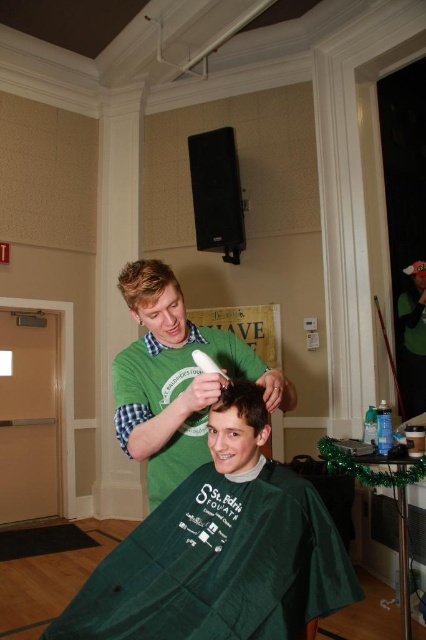
Can you confirm if green matte shirt at center is positioned to the left of blonde hair at upper center?

No, green matte shirt at center is not to the left of blonde hair at upper center.

In order to click on green matte shirt at center in this screenshot , I will do `click(175, 380)`.

Which is in front, point (155, 364) or point (135, 314)?

Point (135, 314) is in front.

The height and width of the screenshot is (640, 426). In order to click on green matte shirt at center in this screenshot , I will do `click(175, 380)`.

Is green fabric cape at center to the right of brown matte hair at center from the viewer's perspective?

Incorrect, green fabric cape at center is not on the right side of brown matte hair at center.

Between point (189, 611) and point (238, 406), which one is positioned in front?

Point (189, 611) is more forward.

The width and height of the screenshot is (426, 640). What are the coordinates of `green fabric cape at center` in the screenshot? It's located at (219, 556).

Is green matte shirt at center wider than brown matte hair at center?

Indeed, green matte shirt at center has a greater width compared to brown matte hair at center.

Describe the element at coordinates (175, 380) in the screenshot. I see `green matte shirt at center` at that location.

Who is more forward, (178, 385) or (241, 401)?

Point (241, 401) is in front.

At what (x,y) coordinates should I click in order to perform the action: click on green matte shirt at center. Please return your answer as a coordinate pair (x, y). This screenshot has height=640, width=426. Looking at the image, I should click on (175, 380).